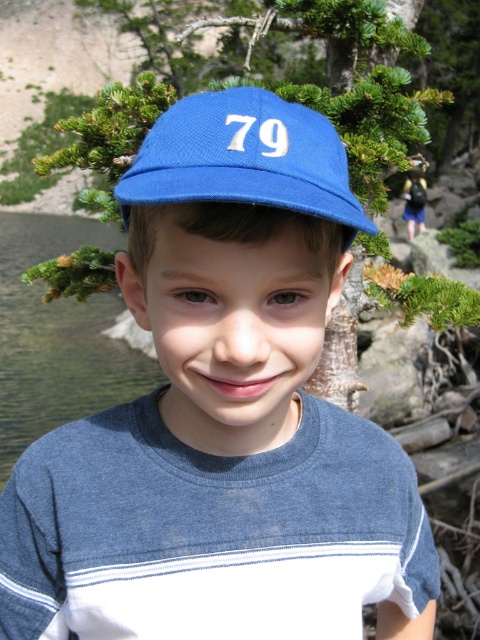
Which of these two, green leafy branches at upper center or blue fabric baseball cap at center, stands shorter?

blue fabric baseball cap at center is shorter.

Does green leafy branches at upper center appear on the left side of blue fabric baseball cap at center?

In fact, green leafy branches at upper center is to the right of blue fabric baseball cap at center.

The image size is (480, 640). In order to click on green leafy branches at upper center in this screenshot , I will do `click(360, 86)`.

Who is lower down, green leafy branches at upper center or clear water at lake left?

clear water at lake left

Does green leafy branches at upper center appear over clear water at lake left?

Yes.

Find the location of a particular element. green leafy branches at upper center is located at coordinates click(x=360, y=86).

This screenshot has width=480, height=640. Find the location of `green leafy branches at upper center`. green leafy branches at upper center is located at coordinates (360, 86).

Describe the element at coordinates (244, 157) in the screenshot. The height and width of the screenshot is (640, 480). I see `blue fabric baseball cap at center` at that location.

The width and height of the screenshot is (480, 640). Identify the location of blue fabric baseball cap at center. (244, 157).

The width and height of the screenshot is (480, 640). In order to click on blue fabric baseball cap at center in this screenshot , I will do `click(244, 157)`.